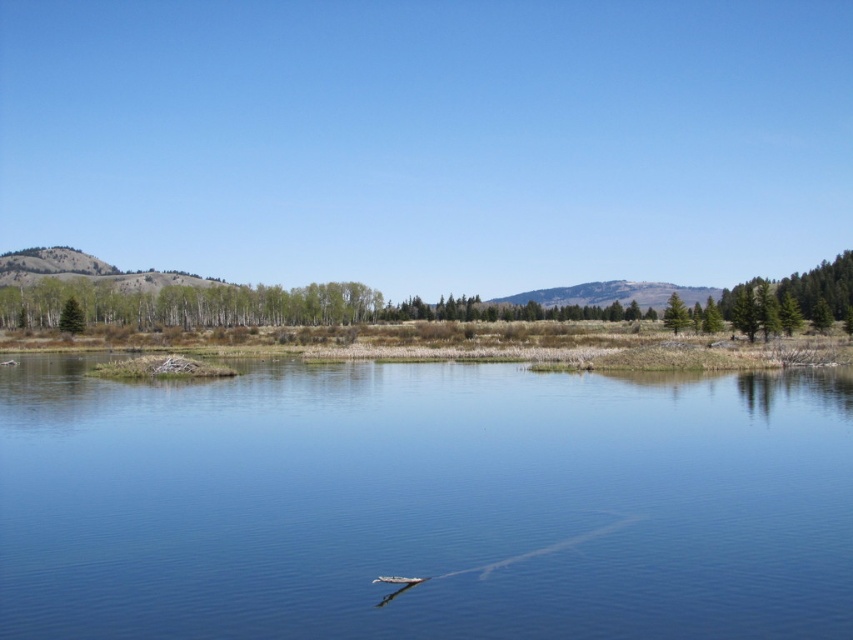
Question: Is green textured tree at right bigger than green matte tree at upper right?

Choices:
 (A) no
 (B) yes

Answer: (B)

Question: Is green textured tree at right closer to camera compared to green matte tree at left?

Choices:
 (A) no
 (B) yes

Answer: (B)

Question: Among these points, which one is nearest to the camera?

Choices:
 (A) (73, 300)
 (B) (556, 632)

Answer: (B)

Question: Among these objects, which one is farthest from the camera?

Choices:
 (A) green matte tree at upper right
 (B) clear water at center
 (C) green matte tree at left

Answer: (C)

Question: Can you confirm if green matte tree at left is smaller than green matte tree at upper right?

Choices:
 (A) no
 (B) yes

Answer: (B)

Question: Which object appears farthest from the camera in this image?

Choices:
 (A) clear water at center
 (B) green matte tree at left

Answer: (B)